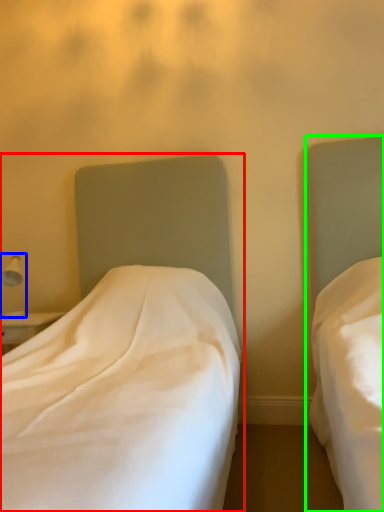
Question: Based on their relative distances, which object is nearer to bed (highlighted by a red box)? Choose from bedside lamp (highlighted by a blue box) and bed (highlighted by a green box).

Choices:
 (A) bedside lamp
 (B) bed

Answer: (B)